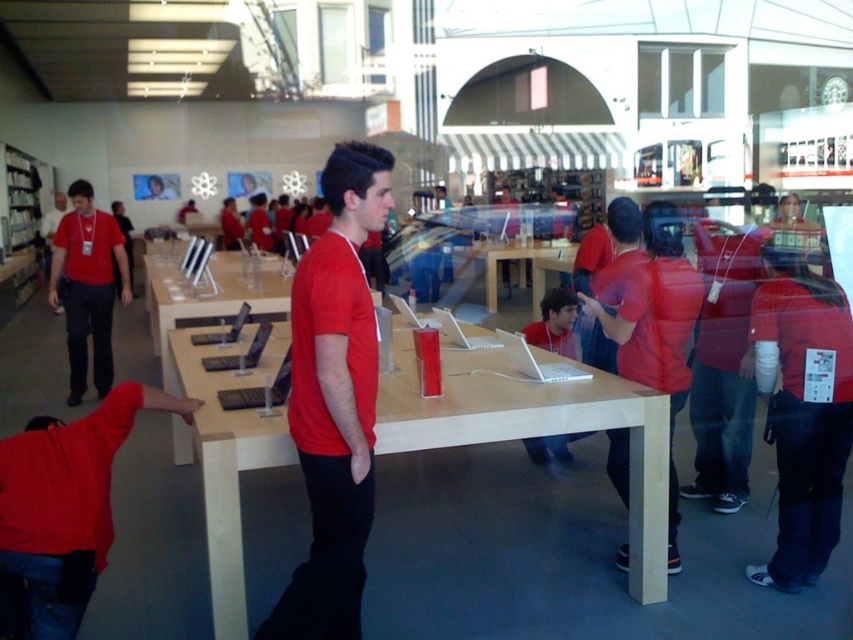
Question: Can you confirm if light wood table at center is positioned below white fabric pants at lower right?

Choices:
 (A) no
 (B) yes

Answer: (A)

Question: Estimate the real-world distances between objects in this image. Which object is closer to the matte red shirt at right?

Choices:
 (A) wooden table at center
 (B) matte red shirt at lower left
 (C) white fabric pants at lower right

Answer: (C)

Question: Can you confirm if matte red shirt at lower left is wider than wooden table at center?

Choices:
 (A) yes
 (B) no

Answer: (B)

Question: Based on their relative distances, which object is nearer to the matte red shirt at left?

Choices:
 (A) matte red shirt at right
 (B) wooden table at center
 (C) red matte shirt at center
 (D) light wood table at center

Answer: (D)

Question: Does red matte shirt at center have a lesser width compared to matte red shirt at lower left?

Choices:
 (A) no
 (B) yes

Answer: (B)

Question: Which of the following is the closest to the observer?

Choices:
 (A) (39, 584)
 (B) (343, 572)
 (C) (550, 422)
 (D) (671, 272)

Answer: (B)